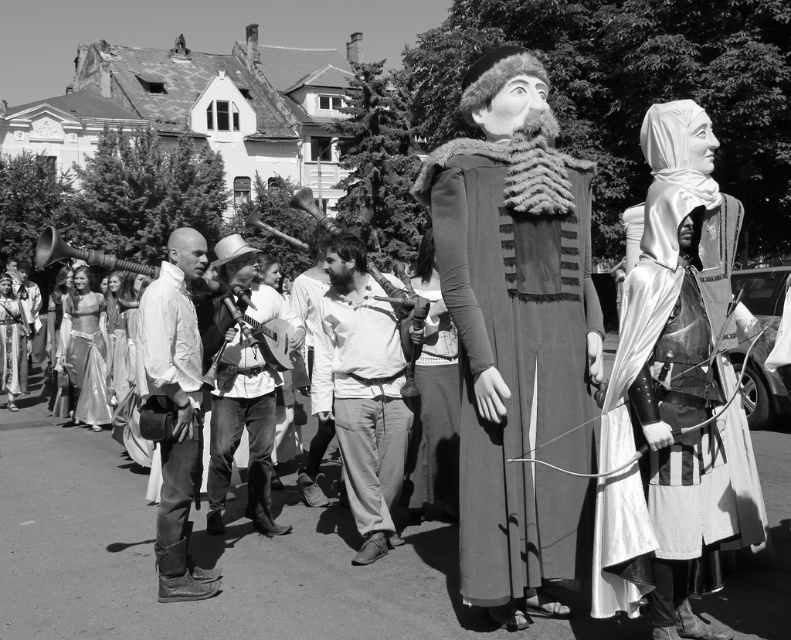
Question: Which point is farther to the camera?

Choices:
 (A) (309, 464)
 (B) (53, 346)

Answer: (B)

Question: Which object appears closest to the camera in this image?

Choices:
 (A) light gray cotton pants at center
 (B) leather jacket at center
 (C) silky white dress at left

Answer: (A)

Question: Can you confirm if white leather pants at center is wider than silky white dress at left?

Choices:
 (A) no
 (B) yes

Answer: (A)

Question: Does silvery metallic armor at right come behind white leather pants at center?

Choices:
 (A) no
 (B) yes

Answer: (A)

Question: Among these objects, which one is farthest from the camera?

Choices:
 (A) silvery metallic armor at right
 (B) silky white dress at left
 (C) light gray cotton pants at center

Answer: (B)

Question: Is white leather pants at center positioned in front of silky white dress at center?

Choices:
 (A) yes
 (B) no

Answer: (A)